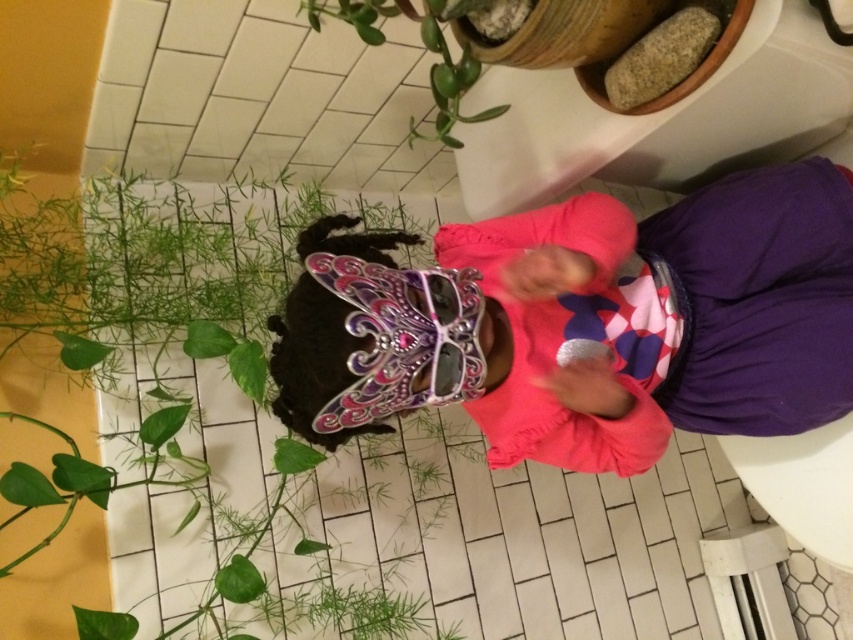
Which is behind, point (650, 280) or point (331, 12)?

The point (650, 280) is behind.

Which of these two, pink metallic mask at center or green glossy plant at upper center, stands shorter?

green glossy plant at upper center

Identify the location of pink metallic mask at center. Image resolution: width=853 pixels, height=640 pixels. (585, 323).

The width and height of the screenshot is (853, 640). In order to click on pink metallic mask at center in this screenshot , I will do [585, 323].

The image size is (853, 640). I want to click on pink metallic mask at center, so click(585, 323).

The image size is (853, 640). What do you see at coordinates (585, 323) in the screenshot?
I see `pink metallic mask at center` at bounding box center [585, 323].

You are a GUI agent. You are given a task and a screenshot of the screen. Output one action in this format:
    pyautogui.click(x=<x>, y=<y>)
    Task: Click on the pink metallic mask at center
    This screenshot has height=640, width=853.
    Given the screenshot: What is the action you would take?
    pyautogui.click(x=585, y=323)

Is green leafy plant at center wider than green glossy plant at upper center?

Yes, green leafy plant at center is wider than green glossy plant at upper center.

Is point (196, 316) farther from camera compared to point (450, 60)?

Yes, it is behind point (450, 60).

Is point (238, 273) in front of point (439, 74)?

That is False.

You are a GUI agent. You are given a task and a screenshot of the screen. Output one action in this format:
    pyautogui.click(x=<x>, y=<y>)
    Task: Click on the green leafy plant at center
    The image size is (853, 640).
    Given the screenshot: What is the action you would take?
    pyautogui.click(x=178, y=358)